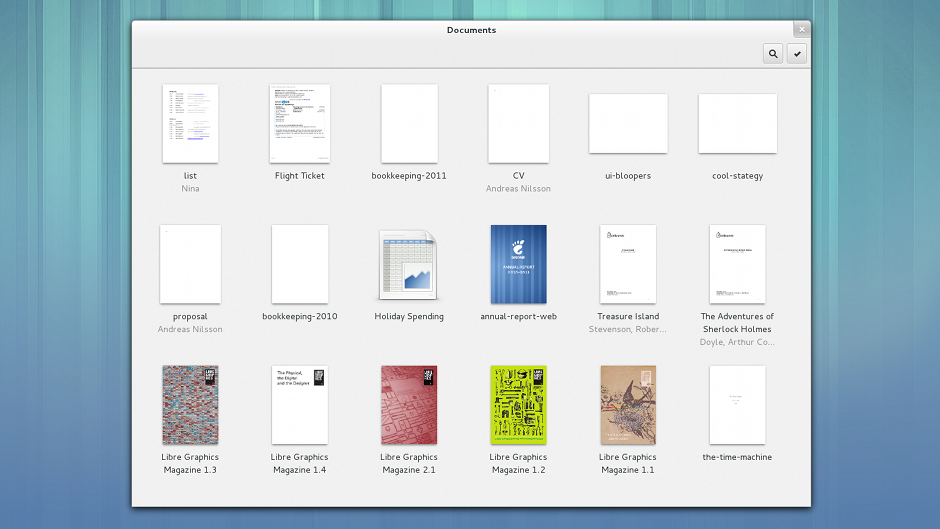
Where is `magazines and books`? magazines and books is located at coordinates pyautogui.click(x=177, y=415), pyautogui.click(x=301, y=410), pyautogui.click(x=418, y=414), pyautogui.click(x=537, y=416), pyautogui.click(x=630, y=411), pyautogui.click(x=724, y=251), pyautogui.click(x=606, y=266), pyautogui.click(x=741, y=427).